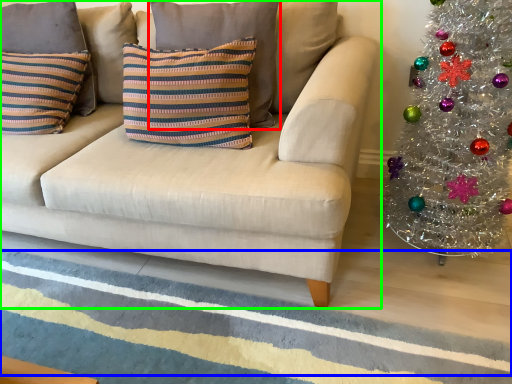
Question: Which object is the farthest from pillow (highlighted by a red box)? Choose among these: stripe (highlighted by a blue box) or studio couch (highlighted by a green box).

Choices:
 (A) stripe
 (B) studio couch

Answer: (A)